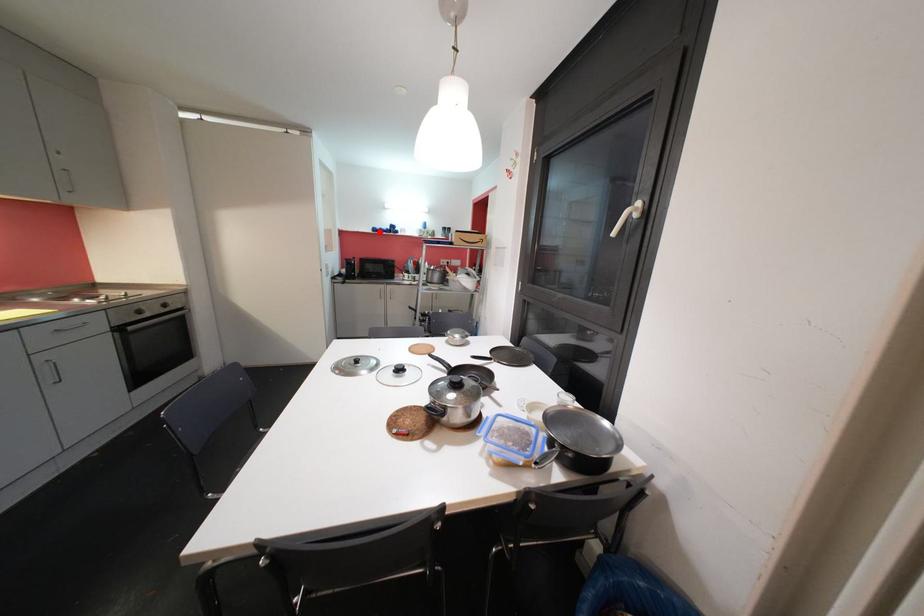
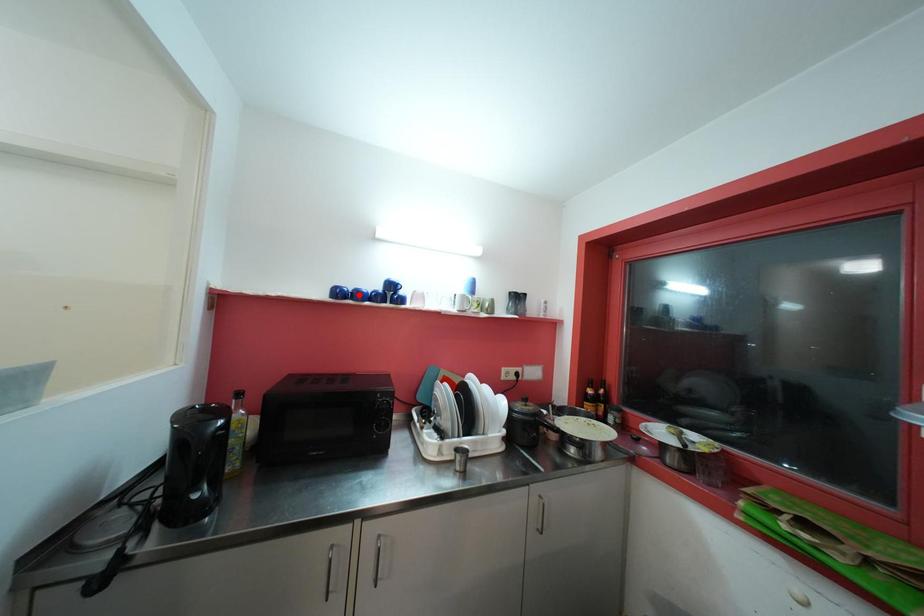
I am providing you with two images of the same scene from different viewpoints. A red point is marked on the first image and another point is marked on the second image. Is the marked point in image1 the same physical position as the marked point in image2?

No